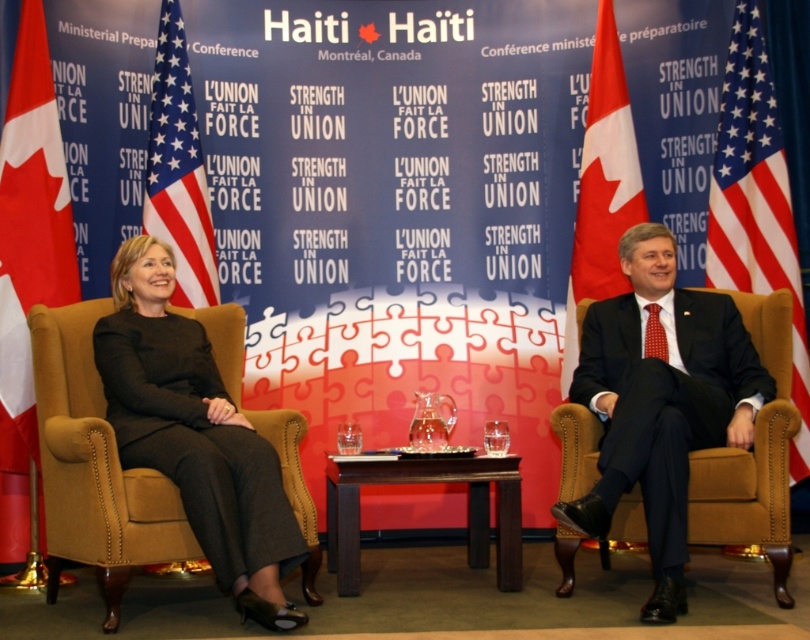
Question: Which point is farther to the camera?

Choices:
 (A) american flag at left
 (B) american flag at right
 (C) black fabric suit at left

Answer: (A)

Question: Is dark suit at center bigger than black fabric suit at left?

Choices:
 (A) no
 (B) yes

Answer: (B)

Question: Which of the following is the farthest from the observer?

Choices:
 (A) american flag at right
 (B) american flag at left

Answer: (B)

Question: Considering the real-world distances, which object is farthest from the black fabric dress at left?

Choices:
 (A) dark suit at center
 (B) american flag at left
 (C) red fabric flag at right
 (D) black fabric suit at left

Answer: (B)

Question: Is black fabric suit at left closer to camera compared to red fabric flag at left?

Choices:
 (A) no
 (B) yes

Answer: (B)

Question: Does black fabric suit at left appear on the right side of american flag at right?

Choices:
 (A) yes
 (B) no

Answer: (B)